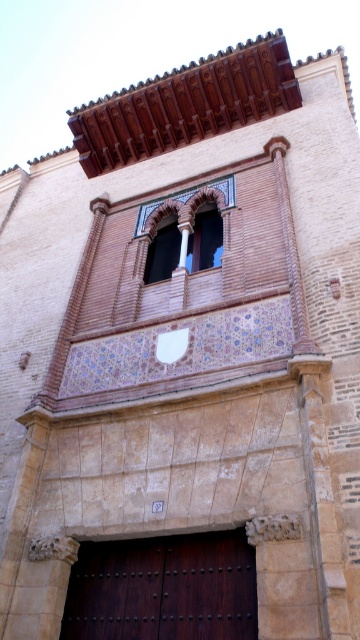
In the scene shown: You are an architect designing a new building inspired by this historic structure. You need to ensure that the dark brown wood at center and the terracotta brick window at center maintain their proportional relationship as seen in the original. Which object should you make wider in your design to stay true to the original?

The dark brown wood at center should be made wider in the design since its width is larger than the terracotta brick window at center in the original structure.